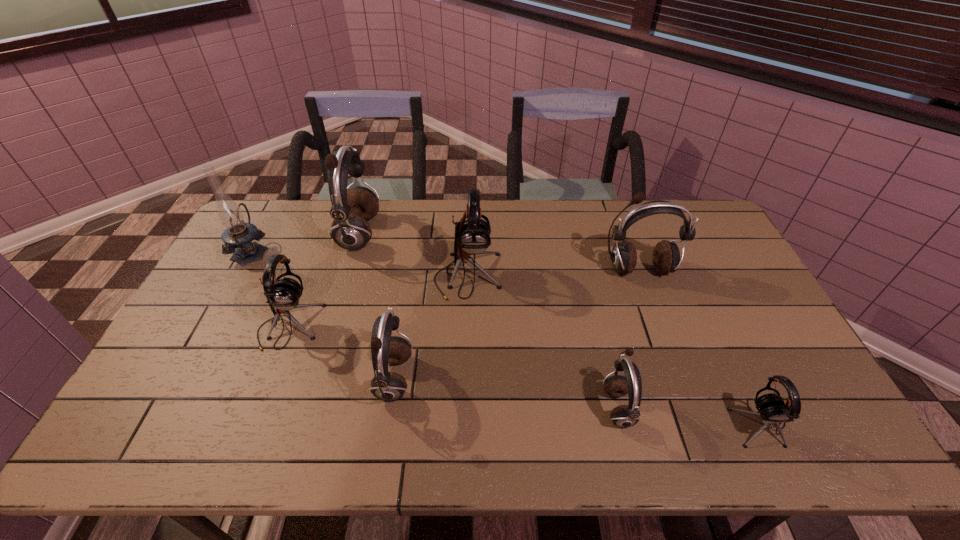
Select which black earphone appears as the closest to the biggest brown earphone. Please provide its 2D coordinates. Your answer should be formatted as a tuple, i.e. [(x, y)], where the tuple contains the x and y coordinates of a point satisfying the conditions above.

[(283, 294)]

Locate an element on the screen. Image resolution: width=960 pixels, height=540 pixels. vacant space that satisfies the following two spatial constraints: 1. on the ear pads of the rightmost black earphone; 2. on the left side of the sixth object from left to right is located at coordinates (621, 422).

Find the location of `blank area in the image that satisfies the following two spatial constraints: 1. on the front side of the farthest black earphone; 2. on the ear pads of the fourth object from left to right`. blank area in the image that satisfies the following two spatial constraints: 1. on the front side of the farthest black earphone; 2. on the ear pads of the fourth object from left to right is located at coordinates (465, 380).

At what (x,y) coordinates should I click in order to perform the action: click on blank space that satisfies the following two spatial constraints: 1. on the front side of the smallest black earphone; 2. on the left side of the fourth earphone from right to left. Please return your answer as a coordinate pair (x, y). The width and height of the screenshot is (960, 540). Looking at the image, I should click on (464, 422).

What are the coordinates of `vacant region that satisfies the following two spatial constraints: 1. on the ear pads of the second biggest brown earphone; 2. on the left side of the smallest black earphone` in the screenshot? It's located at [693, 422].